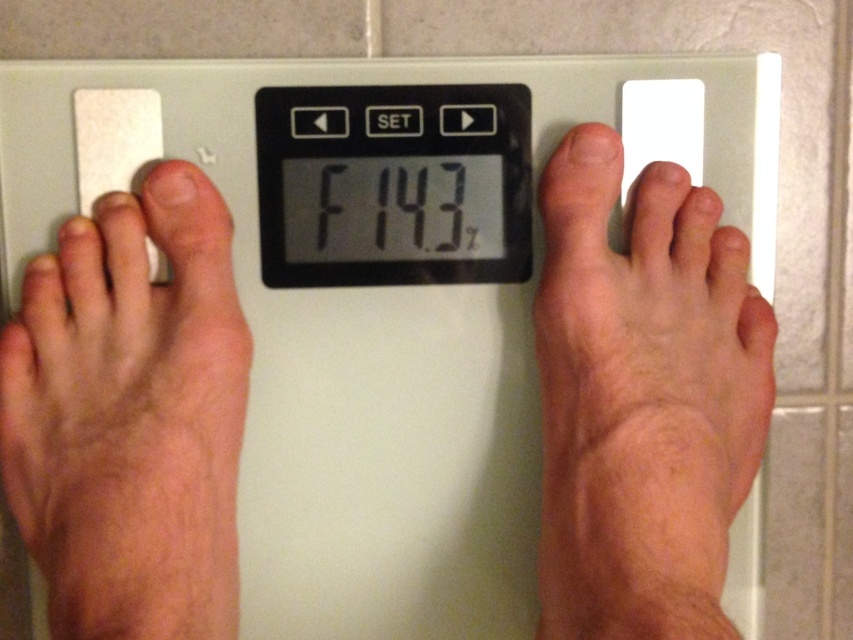
Who is shorter, skinny bare feet at center or black plastic scale at center?

Standing shorter between the two is black plastic scale at center.

Describe the element at coordinates (642, 397) in the screenshot. The height and width of the screenshot is (640, 853). I see `skinny bare feet at center` at that location.

Where is `skinny bare feet at center`? The width and height of the screenshot is (853, 640). skinny bare feet at center is located at coordinates [642, 397].

Does point (611, 595) lie behind point (141, 253)?

No, (611, 595) is closer to viewer.

Identify the location of smooth skin foot at right. (642, 397).

The height and width of the screenshot is (640, 853). I want to click on skinny bare feet at center, so click(642, 397).

How far apart are skinny bare feet at center and white plastic scale at center?

A distance of 4.34 inches exists between skinny bare feet at center and white plastic scale at center.

Is point (62, 397) positioned before point (614, 80)?

Yes, it is in front of point (614, 80).

Find the location of a particular element. The width and height of the screenshot is (853, 640). skinny bare feet at center is located at coordinates (642, 397).